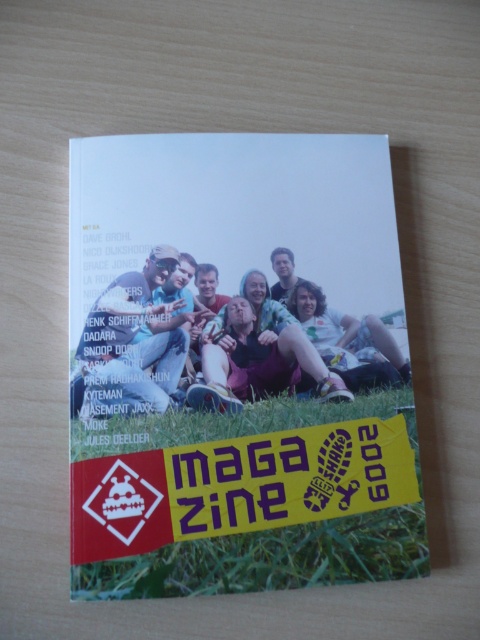
Question: Does green grass at lower center appear on the left side of matte black laptop at center?

Choices:
 (A) no
 (B) yes

Answer: (A)

Question: Can you confirm if green grass at lower center is positioned below green fabric pants at center?

Choices:
 (A) yes
 (B) no

Answer: (A)

Question: Which point is closer to the camera?

Choices:
 (A) green grass at lower center
 (B) light blue fabric at center

Answer: (A)

Question: Which point appears closest to the camera in this image?

Choices:
 (A) (247, 552)
 (B) (148, 316)

Answer: (A)

Question: Which of the following is the farthest from the observer?

Choices:
 (A) click(x=256, y=545)
 (B) click(x=365, y=474)

Answer: (B)

Question: Does light blue fabric at center appear over matte black laptop at center?

Choices:
 (A) yes
 (B) no

Answer: (A)